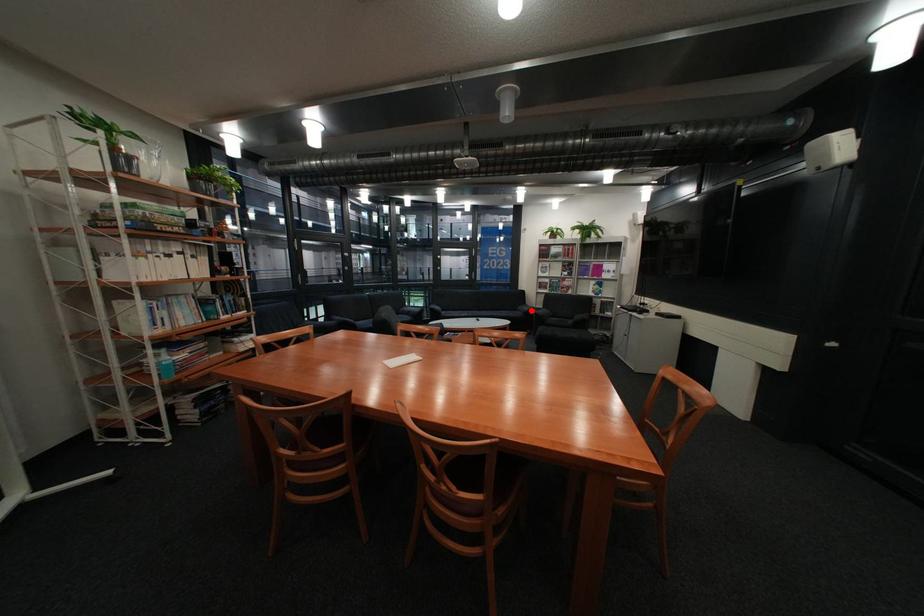
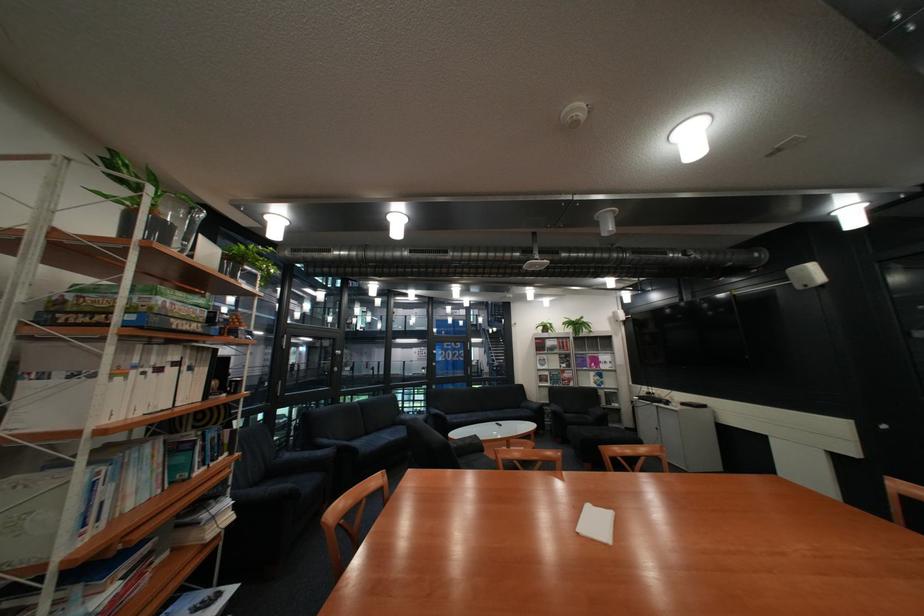
The point at the highlighted location is marked in the first image. Where is the corresponding point in the second image?

(535, 408)